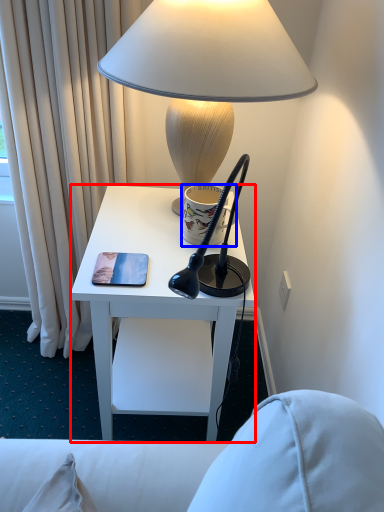
Question: Which point is closer to the camera, desk (highlighted by a red box) or coffee cup (highlighted by a blue box)?

Choices:
 (A) desk
 (B) coffee cup

Answer: (A)